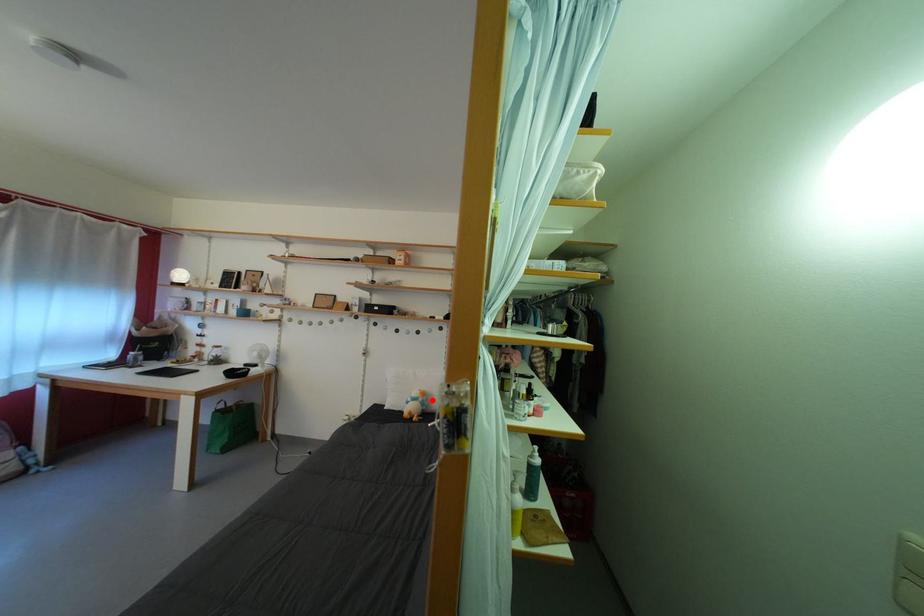
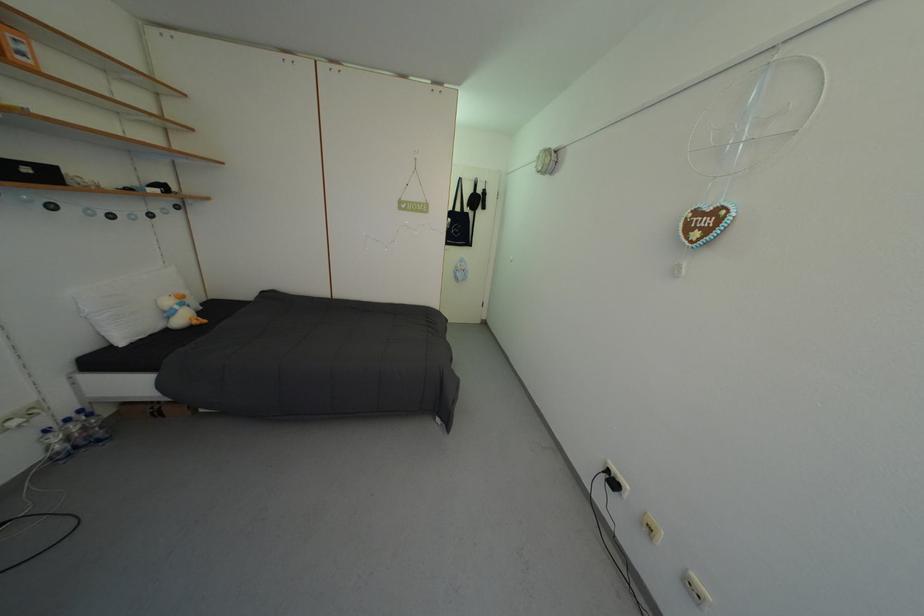
Question: I am providing you with two images of the same scene from different viewpoints. Image1 has a red point marked. In image2, the corresponding 3D location appears at what relative position? Reply with the corresponding letter.

Choices:
 (A) Closer
 (B) Farther

Answer: (A)